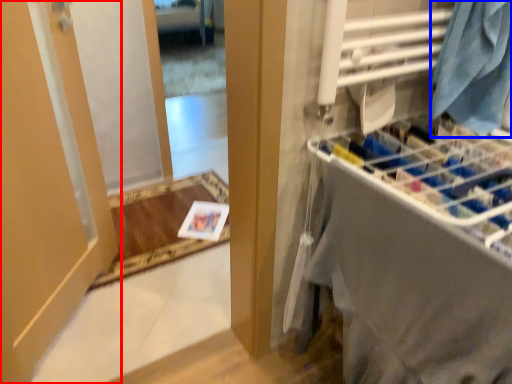
Question: Which of the following is the closest to the observer, door (highlighted by a red box) or clothing (highlighted by a blue box)?

Choices:
 (A) door
 (B) clothing

Answer: (A)